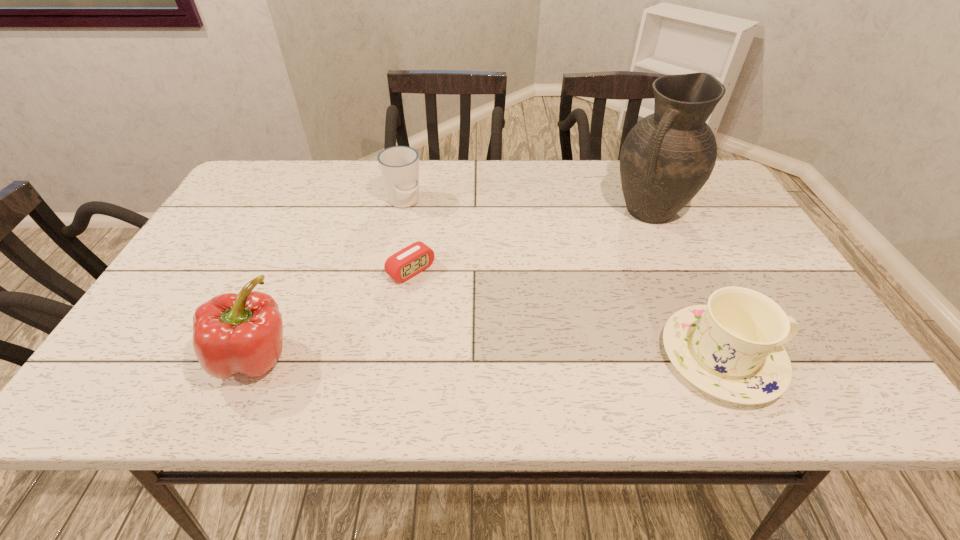
Locate an element on the screen. This screenshot has width=960, height=540. unoccupied position between the cup and the chinaware is located at coordinates (563, 279).

Locate an element on the screen. free space between the tallest object and the third nearest object is located at coordinates (530, 240).

Find the location of a particular element. blank region between the alarm clock and the chinaware is located at coordinates (566, 314).

The image size is (960, 540). I want to click on vacant area between the cup and the chinaware, so click(x=563, y=279).

This screenshot has width=960, height=540. In order to click on unoccupied position between the pepper and the alarm clock in this screenshot , I will do `click(333, 313)`.

The width and height of the screenshot is (960, 540). I want to click on free spot between the pitcher and the chinaware, so click(x=685, y=284).

Find the location of a particular element. free area in between the cup and the tallest object is located at coordinates (527, 206).

The width and height of the screenshot is (960, 540). Identify the location of vacant region between the cup and the third farthest object. coord(408,236).

Where is `vacant region between the alarm clock and the chinaware`? The height and width of the screenshot is (540, 960). vacant region between the alarm clock and the chinaware is located at coordinates (566, 314).

Identify the location of the fourth closest object to the cup. Image resolution: width=960 pixels, height=540 pixels. (732, 348).